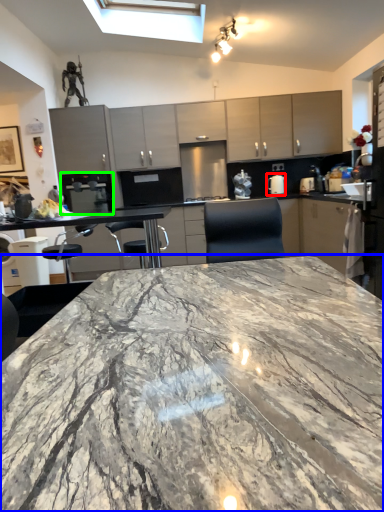
Question: Estimate the real-world distances between objects in this image. Which object is closer to appliance (highlighted by a red box), countertop (highlighted by a blue box) or appliance (highlighted by a green box)?

Choices:
 (A) countertop
 (B) appliance

Answer: (B)